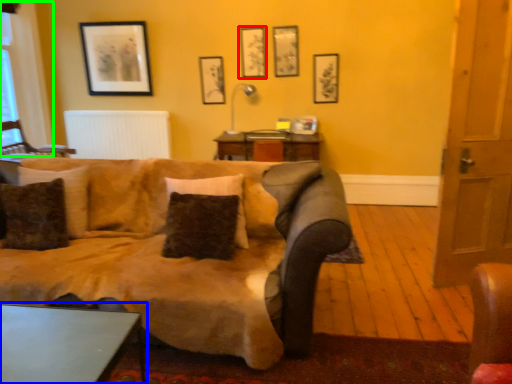
Question: Estimate the real-world distances between objects in this image. Which object is closer to picture frame (highlighted by a red box), table (highlighted by a blue box) or bay window (highlighted by a green box)?

Choices:
 (A) table
 (B) bay window

Answer: (B)